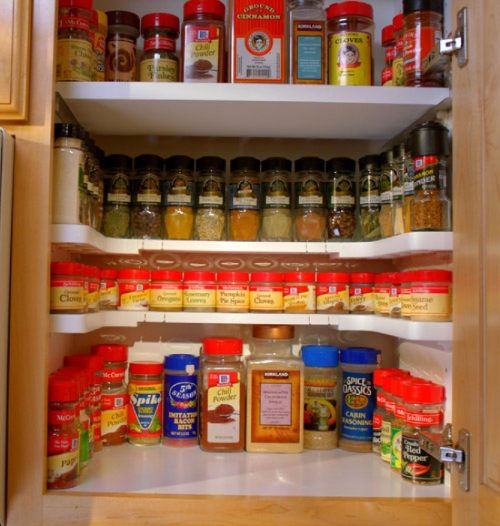
What are the coordinates of `shelves` in the screenshot? It's located at (315, 471), (328, 318), (346, 242), (349, 103).